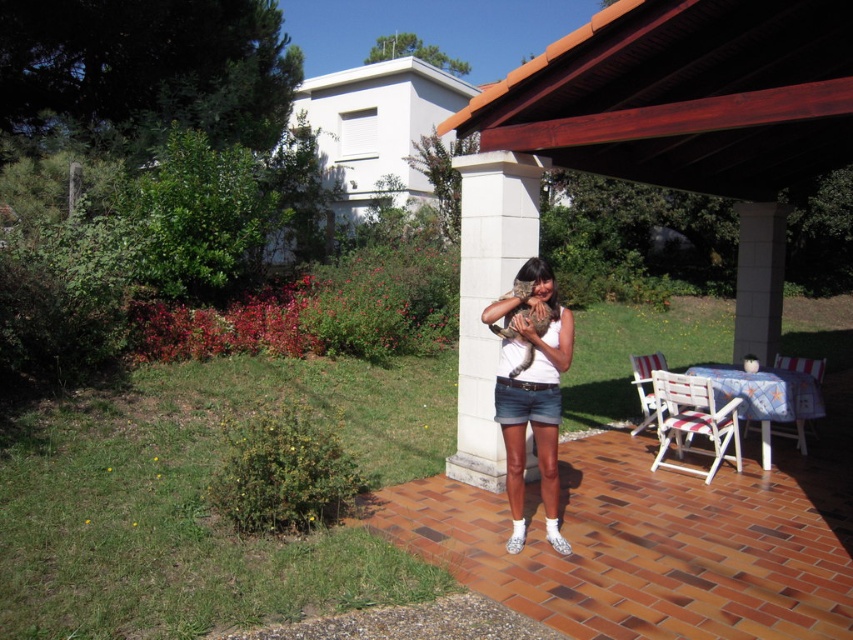
Question: Which object is positioned closest to the white concrete pillar at center?

Choices:
 (A) white striped wood chair at lower right
 (B) brown wood canopy at upper center
 (C) white cotton shirt at center

Answer: (C)

Question: Which object appears farthest from the camera in this image?

Choices:
 (A) plaid fabric chair at lower right
 (B) denim shorts at center
 (C) white striped wood chair at lower right

Answer: (A)

Question: Is denim shorts at center wider than plaid fabric chair at lower right?

Choices:
 (A) yes
 (B) no

Answer: (B)

Question: Can you confirm if denim shorts at center is positioned to the left of white striped wood chair at lower right?

Choices:
 (A) no
 (B) yes

Answer: (B)

Question: Among these points, which one is farthest from the camera?

Choices:
 (A) (613, 17)
 (B) (514, 401)
 (C) (740, 461)
 (D) (660, 362)

Answer: (D)

Question: Can you confirm if white concrete pillar at center is smaller than plaid fabric chair at lower right?

Choices:
 (A) yes
 (B) no

Answer: (B)